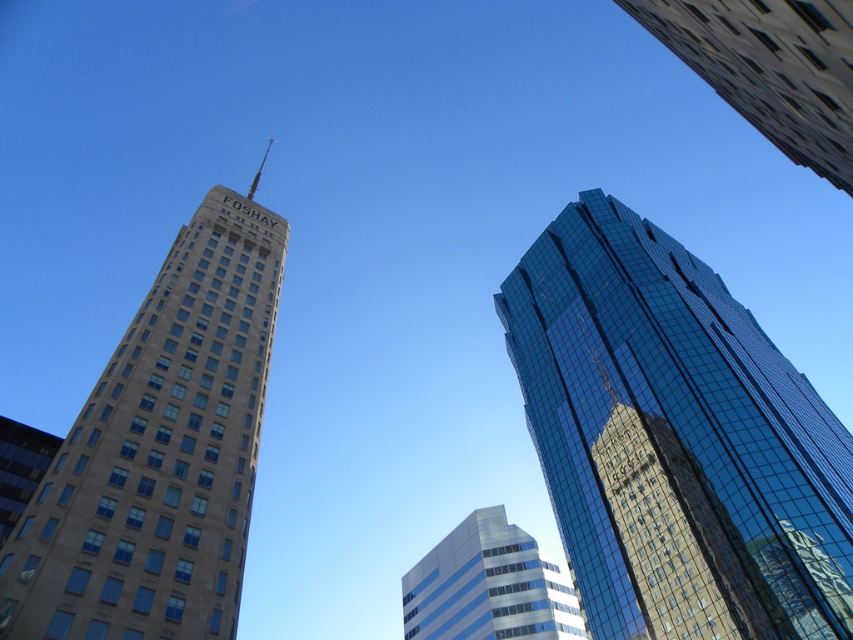
You are standing at the center of the city square and looking towards the tall beige building with a spire. Which direction should you turn to see the shiny glass skyscraper at upper right?

Since the shiny glass skyscraper at upper right is located at point (675, 440) in the image, which is to the right of the center, you should turn to your right to face the shiny glass skyscraper at upper right.

You are a drone operator planning to fly a drone between the shiny glass skyscraper at upper right and the silver glass building at center. The drone requires a minimum of 50 feet of clearance between obstacles to operate safely. Based on the scene, can the drone safely navigate the space between these two buildings?

The shiny glass skyscraper at upper right and silver glass building at center are 86.57 feet apart, which exceeds the drone operator requirement of 50 feet clearance. Therefore, the drone can safely navigate the space between them.